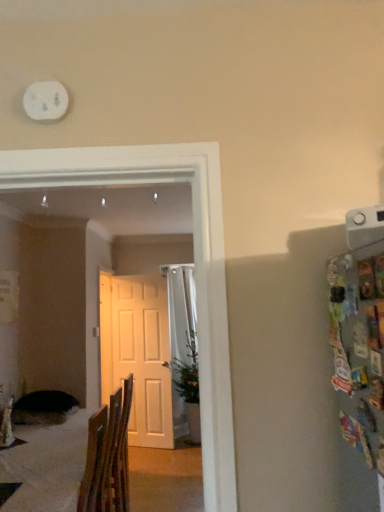
Question: Relative to white matte clock at upper left, is white matte door at center in front or behind?

Choices:
 (A) front
 (B) behind

Answer: (B)

Question: Considering the positions of white matte door at center and white matte clock at upper left in the image, is white matte door at center taller or shorter than white matte clock at upper left?

Choices:
 (A) short
 (B) tall

Answer: (B)

Question: Considering the real-world distances, which object is farthest from the white matte clock at upper left?

Choices:
 (A) white matte door at center
 (B) green leafy plant at center
 (C) wooden chair at lower left

Answer: (A)

Question: Which object is positioned farthest from the green leafy plant at center?

Choices:
 (A) wooden chair at lower left
 (B) white matte door at center
 (C) white matte clock at upper left

Answer: (C)